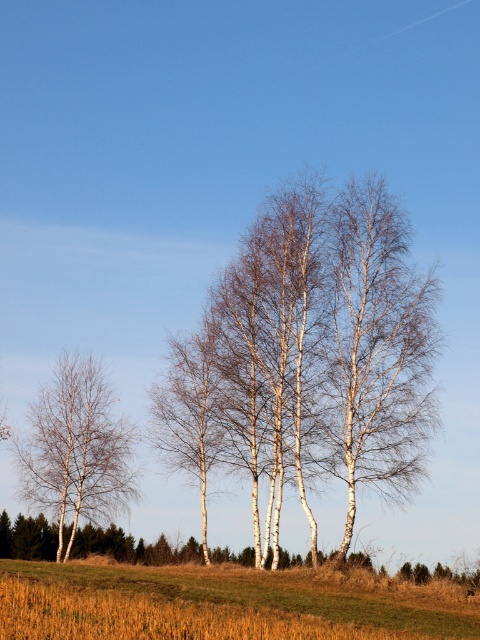
You are standing in the middle of the field and see the brown grass at lower center and the white smooth tree at left. Which object is located higher from the ground?

The brown grass at lower center is above the white smooth tree at left, so the brown grass at lower center is higher from the ground.